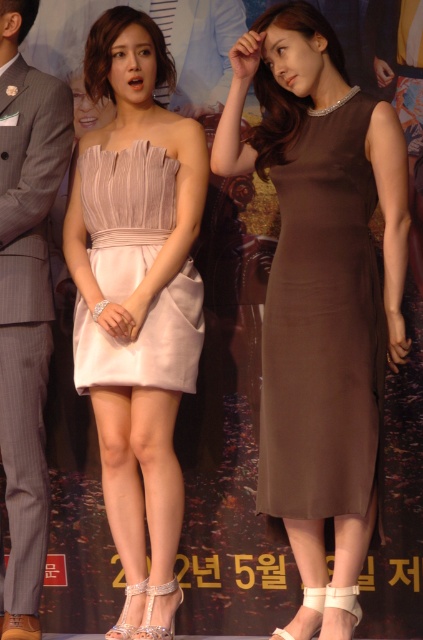
You are a photographer at a fashion show. You need to arrange the two models wearing the matte brown dress at center and the pale pink satin dress at center so that both dresses are visible in the photo. Which dress should be placed closer to the camera to ensure both are fully visible?

The matte brown dress at center is larger than the pale pink satin dress at center, so placing the larger matte brown dress at center further back and the smaller pale pink satin dress at center closer to the camera will ensure both are fully visible in the photo.

Consider the image. You are a photographer at a fashion show. You need to capture a photo where both the brown satin dress at center and the pale pink satin dress at center are visible. Which dress should you focus on first to ensure both are in frame?

The brown satin dress at center is located below the pale pink satin dress at center, so you should focus on the pale pink satin dress at center first to ensure both are in frame.